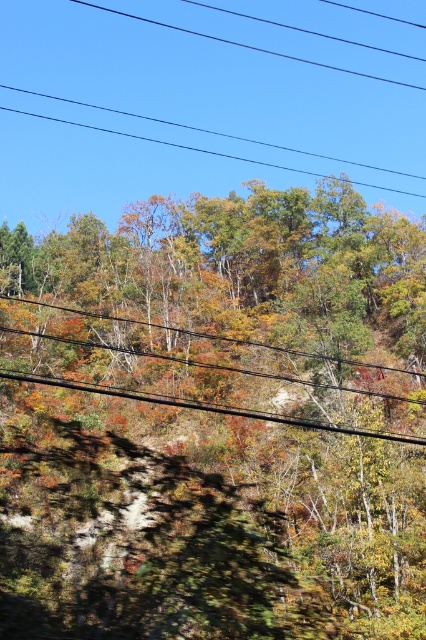
Find the location of a particular element. autumn leaves at upper center is located at coordinates (215, 420).

Does autumn leaves at upper center have a smaller size compared to black wire at upper center?

Yes.

Is point (255, 538) in front of point (241, 161)?

That is True.

What are the coordinates of `autumn leaves at upper center` in the screenshot? It's located at (215, 420).

Who is more forward, (241, 138) or (86, 385)?

Point (86, 385)

Is black wire at upper center to the left of black wire at center from the viewer's perspective?

Incorrect, black wire at upper center is not on the left side of black wire at center.

Locate an element on the screen. This screenshot has height=640, width=426. black wire at upper center is located at coordinates (163, 141).

Does autumn leaves at upper center appear on the right side of black wire at center?

No, autumn leaves at upper center is not to the right of black wire at center.

The image size is (426, 640). What do you see at coordinates (215, 420) in the screenshot?
I see `autumn leaves at upper center` at bounding box center [215, 420].

Locate an element on the screen. Image resolution: width=426 pixels, height=640 pixels. autumn leaves at upper center is located at coordinates (215, 420).